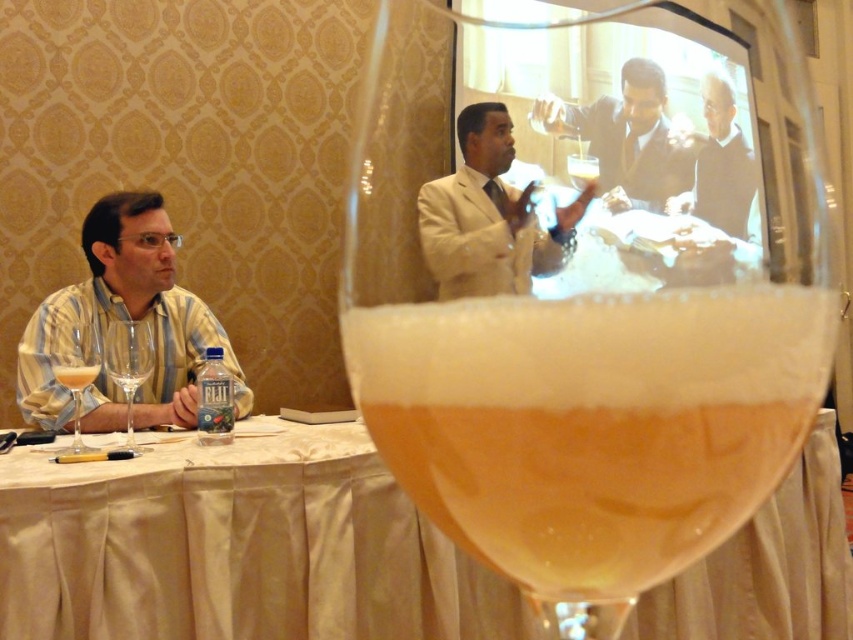
You are a bartender preparing drinks and need to place the beige suit at center and the translucent glass wine at left on a shelf. Which object should you place first if you want to ensure the shorter one is placed first?

The beige suit at center is shorter than the translucent glass wine at left, so you should place the beige suit at center first.

From the picture: You are a bartender preparing drinks for a customer. You have a smooth beige suit at upper center and a translucent glass wine at left in front of you. Which object is shorter in height?

The smooth beige suit at upper center is not as tall as the translucent glass wine at left, so the smooth beige suit at upper center is shorter in height.